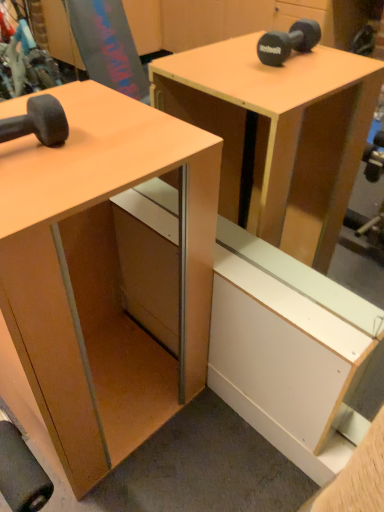
Question: In the image, is matte black dumbbell at left positioned in front of or behind matte wood desk at left?

Choices:
 (A) front
 (B) behind

Answer: (B)

Question: Considering the positions of point (61, 136) and point (165, 168), is point (61, 136) closer or farther from the camera than point (165, 168)?

Choices:
 (A) closer
 (B) farther

Answer: (B)

Question: From a real-world perspective, is matte black dumbbell at left positioned above or below matte wood desk at left?

Choices:
 (A) below
 (B) above

Answer: (B)

Question: From a real-world perspective, is matte wood desk at left positioned above or below matte black dumbbell at left?

Choices:
 (A) above
 (B) below

Answer: (B)

Question: Is matte wood desk at left taller or shorter than matte black dumbbell at left?

Choices:
 (A) tall
 (B) short

Answer: (A)

Question: Is matte wood desk at left bigger or smaller than matte black dumbbell at left?

Choices:
 (A) small
 (B) big

Answer: (B)

Question: Does point (132, 374) appear closer or farther from the camera than point (1, 122)?

Choices:
 (A) closer
 (B) farther

Answer: (B)